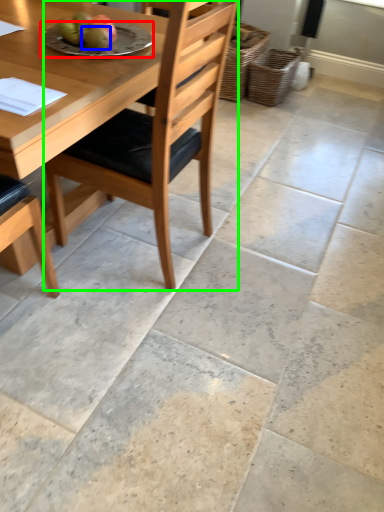
Question: Which object is the farthest from plate (highlighted by a red box)? Choose among these: fruit (highlighted by a blue box) or chair (highlighted by a green box).

Choices:
 (A) fruit
 (B) chair

Answer: (B)